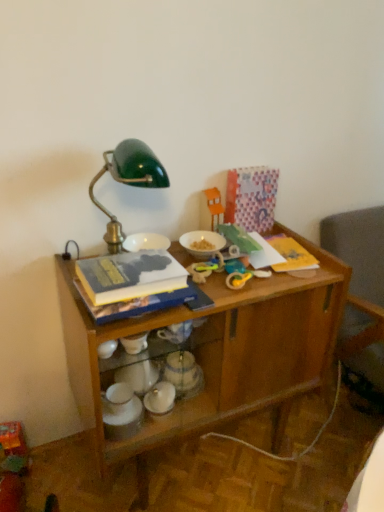
Question: Which direction should I rotate to look at orange plastic toy at upper center, the 1th toy viewed from the back?

Choices:
 (A) left
 (B) right

Answer: (B)

Question: Can you confirm if rubber yellow toy at center, acting as the second toy starting from the back, is shorter than hardcover book at center?

Choices:
 (A) yes
 (B) no

Answer: (A)

Question: Can you confirm if rubber yellow toy at center, which is the 2th toy from front to back, is wider than hardcover book at center?

Choices:
 (A) yes
 (B) no

Answer: (B)

Question: Does rubber yellow toy at center, the second toy in the top-to-bottom sequence, have a greater height compared to hardcover book at center?

Choices:
 (A) no
 (B) yes

Answer: (A)

Question: Does rubber yellow toy at center, the second toy in the top-to-bottom sequence, appear on the left side of hardcover book at center?

Choices:
 (A) yes
 (B) no

Answer: (B)

Question: From a real-world perspective, is rubber yellow toy at center, acting as the second toy starting from the back, beneath hardcover book at center?

Choices:
 (A) no
 (B) yes

Answer: (B)

Question: Does rubber yellow toy at center, which is the 2th toy from front to back, have a larger size compared to hardcover book at center?

Choices:
 (A) yes
 (B) no

Answer: (B)

Question: Does hardcover book at center have a lesser width compared to wooden desk at center?

Choices:
 (A) no
 (B) yes

Answer: (B)

Question: Is hardcover book at center taller than wooden desk at center?

Choices:
 (A) yes
 (B) no

Answer: (B)

Question: Does hardcover book at center have a larger size compared to wooden desk at center?

Choices:
 (A) yes
 (B) no

Answer: (B)

Question: Is hardcover book at center next to wooden desk at center?

Choices:
 (A) yes
 (B) no

Answer: (B)

Question: Is wooden desk at center a part of hardcover book at center?

Choices:
 (A) yes
 (B) no

Answer: (B)

Question: Considering the relative sizes of hardcover book at center and wooden desk at center in the image provided, is hardcover book at center wider than wooden desk at center?

Choices:
 (A) yes
 (B) no

Answer: (B)

Question: Is metallic silver teapot at center, placed as the 2th tableware when sorted from top to bottom, smaller than wooden desk at center?

Choices:
 (A) no
 (B) yes

Answer: (B)